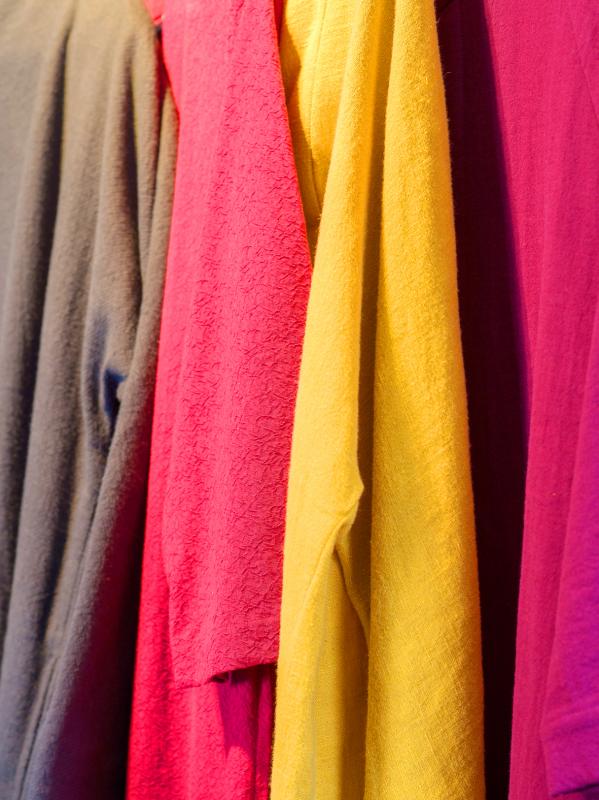
Where is `fabrics`? fabrics is located at coordinates (87, 420), (250, 422), (329, 437), (541, 468).